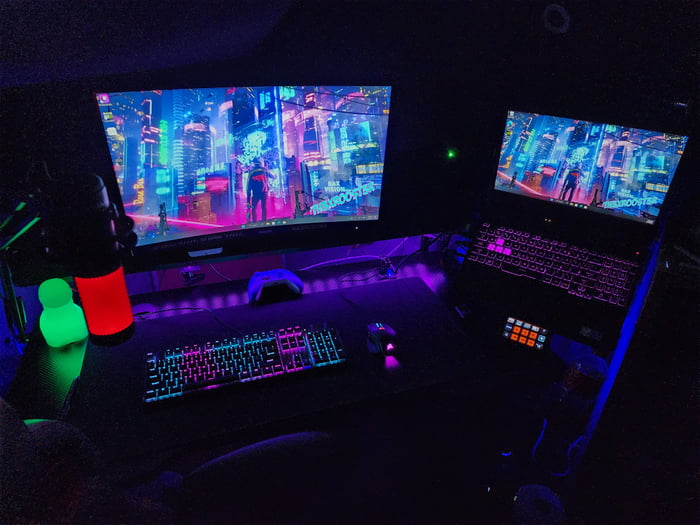
This screenshot has width=700, height=525. Find the location of `keyboard`. keyboard is located at coordinates (538, 260), (269, 356).